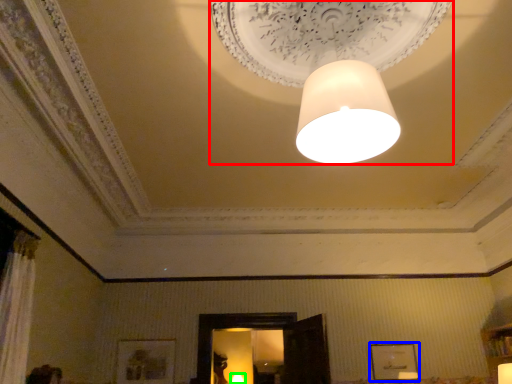
Question: Which object is the closest to the lamp (highlighted by a red box)? Choose among these: picture frame (highlighted by a blue box) or lamp (highlighted by a green box).

Choices:
 (A) picture frame
 (B) lamp

Answer: (A)